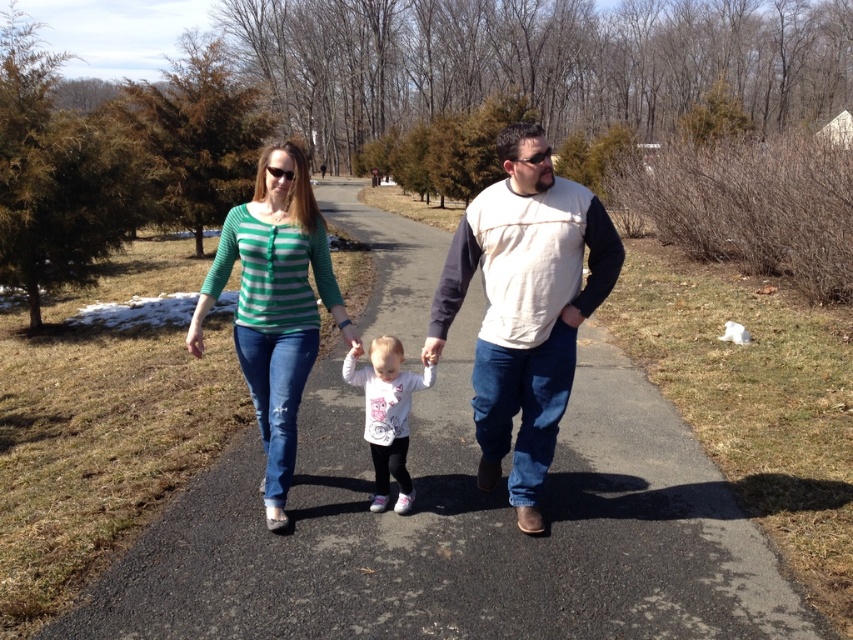
You are a photographer trying to capture a photo of the family. You notice two shirts in the image, the green striped shirt at center and the white matte shirt at center. Which shirt is covering part of the other shirt in the photo?

The green striped shirt at center is positioned over the white matte shirt at center, so it is covering part of it.

You are standing at the point with coordinates point (x=370, y=506) and want to walk towards the point with coordinates point (x=498, y=428). Which direction should you face to move towards it?

Point (x=498, y=428) is closer to the viewer than point (x=370, y=506). Therefore, you should face towards the direction where the point (x=498, y=428) is located, which would be towards the viewer from your current position at point (x=370, y=506).